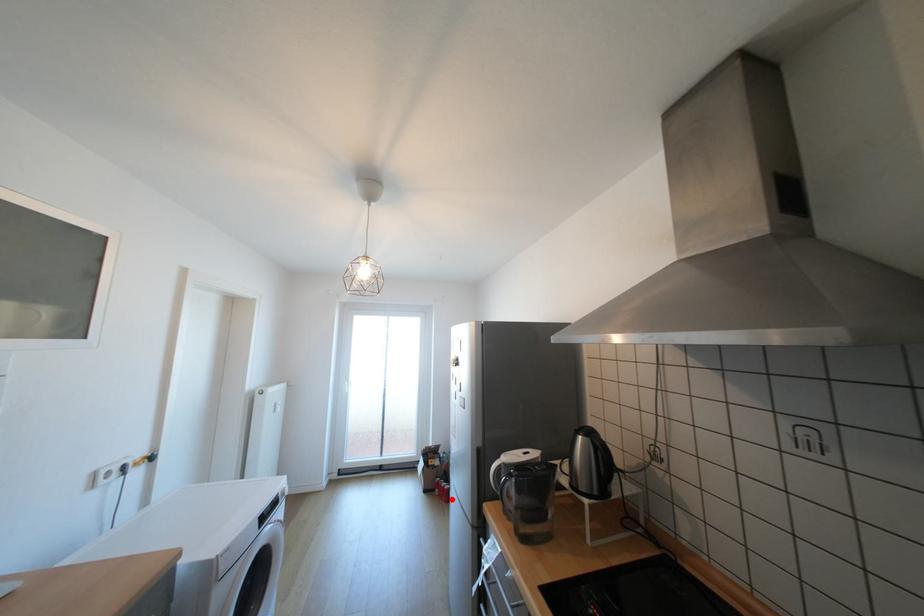
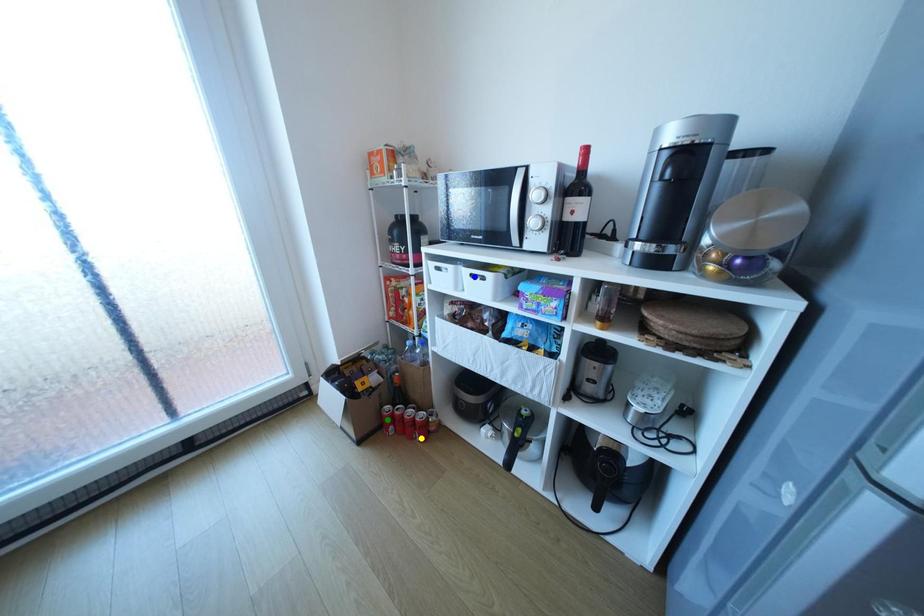
Question: I am providing you with two images of the same scene from different viewpoints. A red point is marked on the first image. You are given multiple points on the second image. Which point in image 2 represents the same 3d spot as the red point in image 1?

Choices:
 (A) yellow point
 (B) green point
 (C) blue point

Answer: (A)